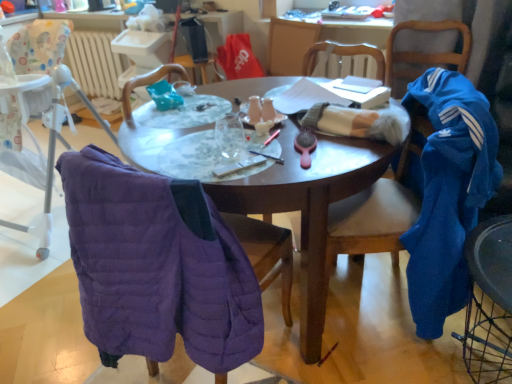
You are a GUI agent. You are given a task and a screenshot of the screen. Output one action in this format:
    pyautogui.click(x=<x>, y=<y>)
    Task: Click on the free space to the left of matte black pen at center
    This screenshot has height=384, width=512.
    Given the screenshot: What is the action you would take?
    pyautogui.click(x=215, y=158)